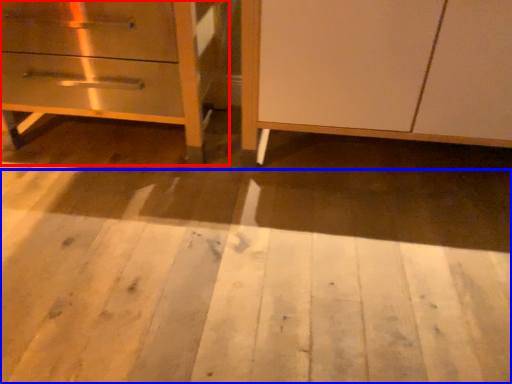
Question: Which object appears farthest to the camera in this image, chest of drawers (highlighted by a red box) or plywood (highlighted by a blue box)?

Choices:
 (A) chest of drawers
 (B) plywood

Answer: (A)